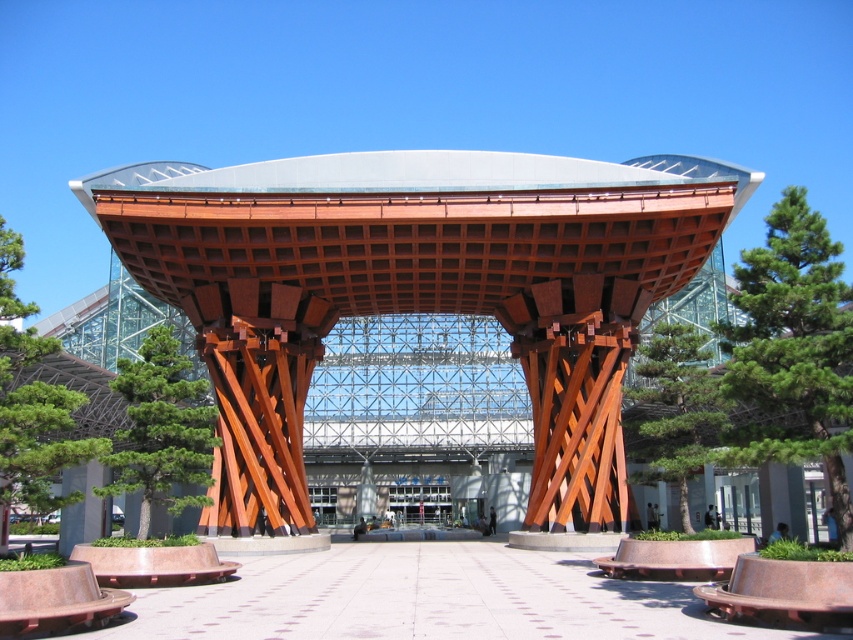
You are standing at the entrance of the pavilion and want to plant a new tree exactly at the center of the plaza. Is the green matte tree at center currently blocking that spot?

The green matte tree at center is located at point (161, 429), which is not the exact center of the plaza. Therefore, it is not blocking the desired planting spot.

You are a maintenance worker needing to water the green leafy tree at center from the wooden lattice canopy at center. The hose you have can extend up to 25 meters. Can you reach the tree from the canopy using the hose?

The distance between the wooden lattice canopy at center and the green leafy tree at center is 26.21 meters. Since the hose can only extend up to 25 meters, you cannot reach the tree from the canopy with the current hose length.